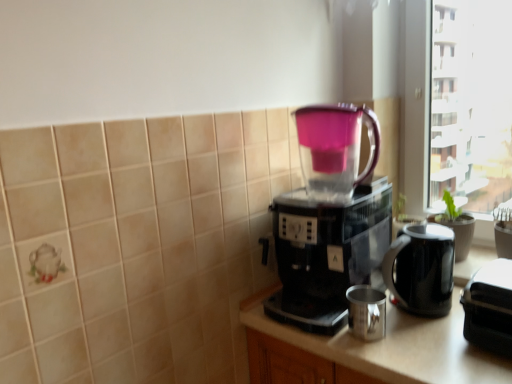
Find the location of a particular element. This screenshot has width=512, height=384. empty space that is to the right of metallic silver mug at lower center is located at coordinates (432, 341).